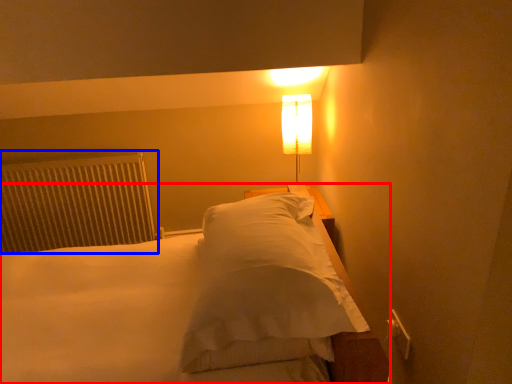
Question: Among these objects, which one is farthest to the camera, bed (highlighted by a red box) or radiator (highlighted by a blue box)?

Choices:
 (A) bed
 (B) radiator

Answer: (B)